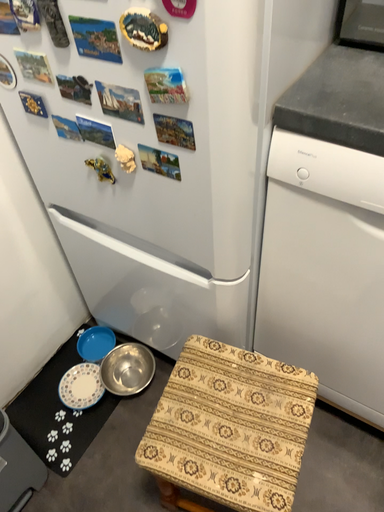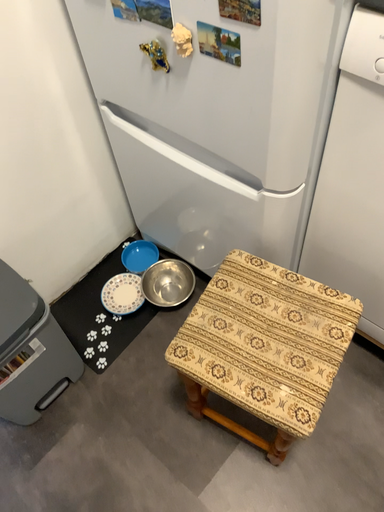
Question: Which way did the camera rotate in the video?

Choices:
 (A) rotated right
 (B) rotated left

Answer: (B)